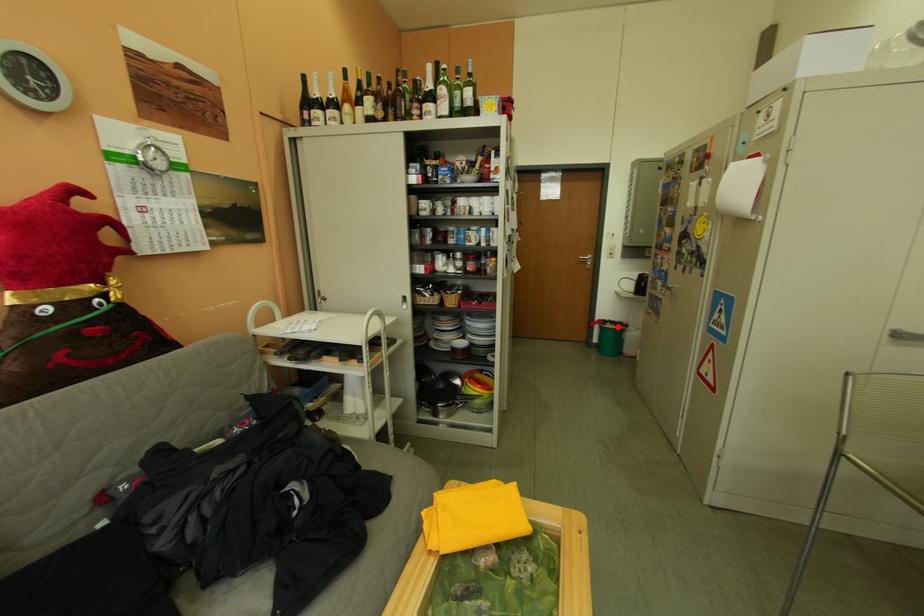
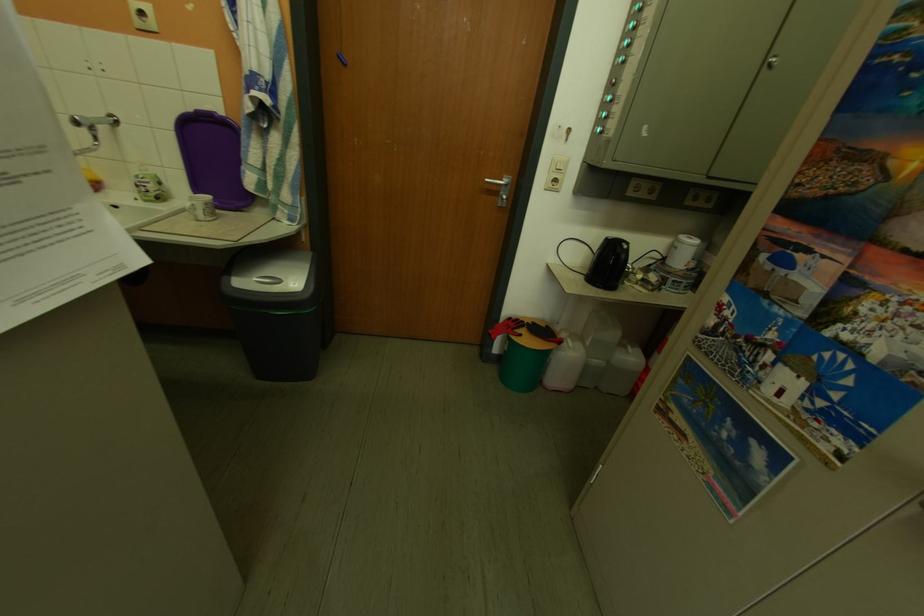
The point at the highlighted location is marked in the first image. Where is the corresponding point in the second image?

(533, 338)